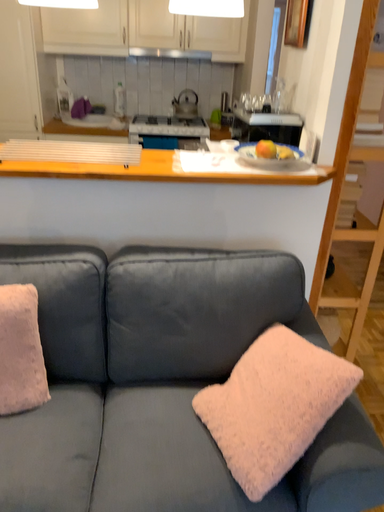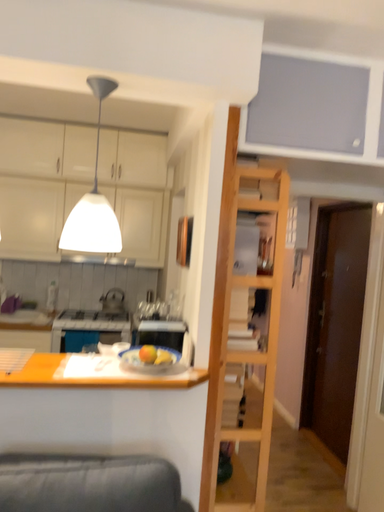
Question: Which way did the camera rotate in the video?

Choices:
 (A) rotated upward
 (B) rotated downward

Answer: (A)